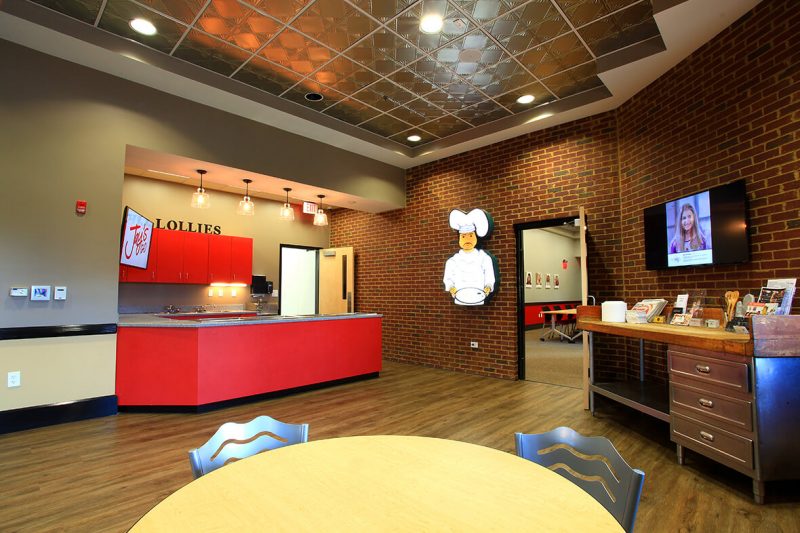
Locate an element on the screen. This screenshot has height=533, width=800. counter is located at coordinates (262, 325).